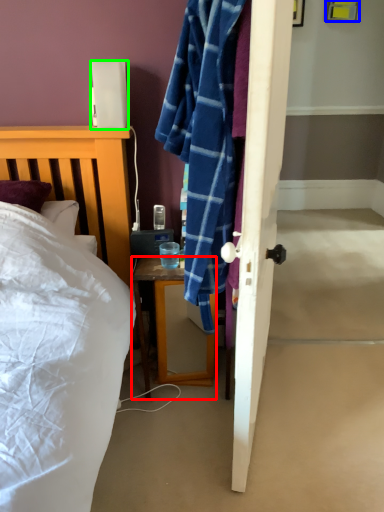
Question: Estimate the real-world distances between objects in this image. Which object is closer to desk (highlighted by a red box), picture frame (highlighted by a blue box) or lamp (highlighted by a green box)?

Choices:
 (A) picture frame
 (B) lamp

Answer: (B)